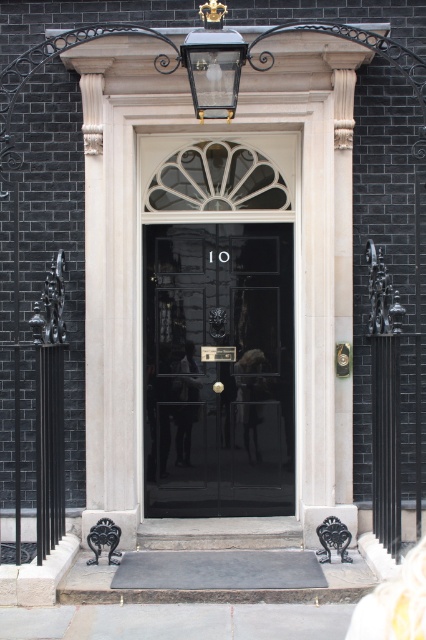
You are standing at the entrance of 10 Downing Street and notice two points marked on the door. The first point is at coordinates point (244,365) and the second is at point (199,83). Which point is closer to you as you face the door?

Point (199,83) is closer to you because it is in front of point (244,365), which is behind it.

You are a delivery person with a package that is 1.2 meters wide. You need to deliver it through the glossy black door at center. Before entering, you notice the clear glass lantern at upper center above the door. Can the package fit through the door without touching the lantern?

The glossy black door at center is wider than the clear glass lantern at upper center. Since the door is wider, the package that is 1.2 meters wide can fit through the glossy black door at center as long as it is within the door width. However, the lantern is above the door and does not affect the width of the doorway. The package should be able to pass through without touching the lantern.

You are a delivery person approaching 10 Downing Street and need to locate the main entrance door. You see the clear glass lantern at upper center and the glossy black door at center. Which object is positioned to the right of the other?

The glossy black door at center is to the right of the clear glass lantern at upper center.